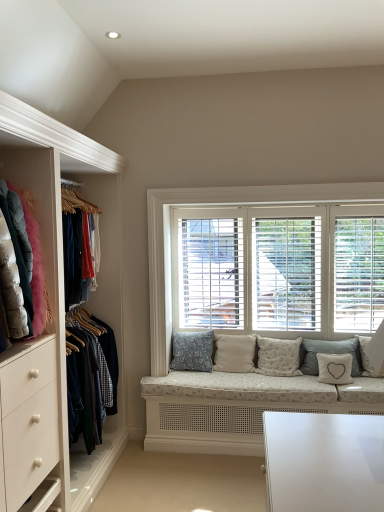
Locate an element on the screen. The image size is (384, 512). vacant area on top of white fabric pillow with heart design at lower right, which ranks as the fourth pillow in left-to-right order (from a real-world perspective) is located at coordinates (331, 355).